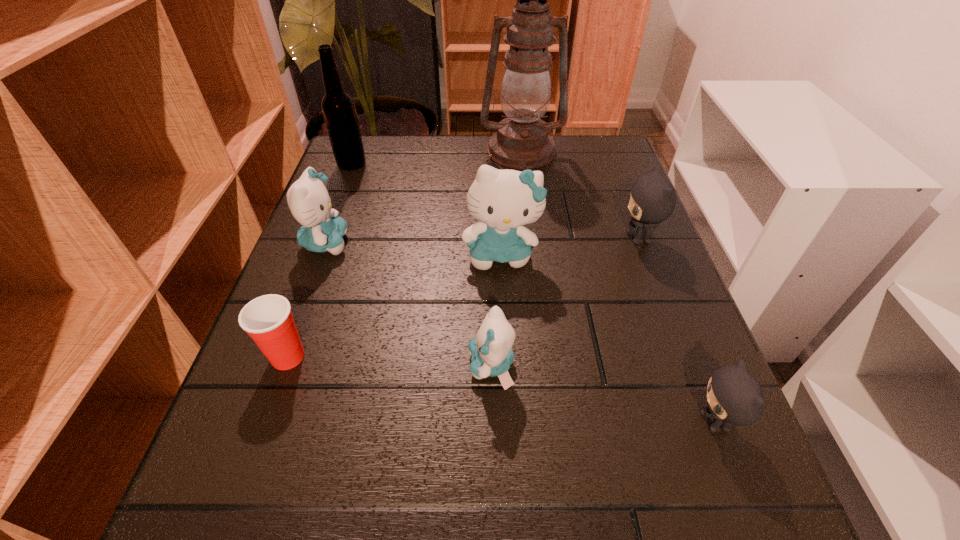
Identify which kitten is located as the nearest to the nearer gray kitten. Please provide its 2D coordinates. Your answer should be formatted as a tuple, i.e. [(x, y)], where the tuple contains the x and y coordinates of a point satisfying the conditions above.

[(492, 354)]

Where is `blue kitten object that ranks as the second closest to the tallest object`? blue kitten object that ranks as the second closest to the tallest object is located at coordinates (309, 201).

Identify the location of blue kitten that stands as the second closest to the smallest blue kitten. This screenshot has width=960, height=540. (309, 201).

This screenshot has width=960, height=540. I want to click on vacant space that satisfies the following two spatial constraints: 1. on the front side of the oil lamp; 2. on the face of the nearest blue kitten, so click(x=548, y=366).

The height and width of the screenshot is (540, 960). I want to click on vacant space that satisfies the following two spatial constraints: 1. on the back side of the Dixie cup; 2. on the left side of the oil lamp, so click(x=362, y=151).

I want to click on vacant space that satisfies the following two spatial constraints: 1. on the face of the second smallest blue kitten; 2. on the right side of the Dixie cup, so click(x=284, y=357).